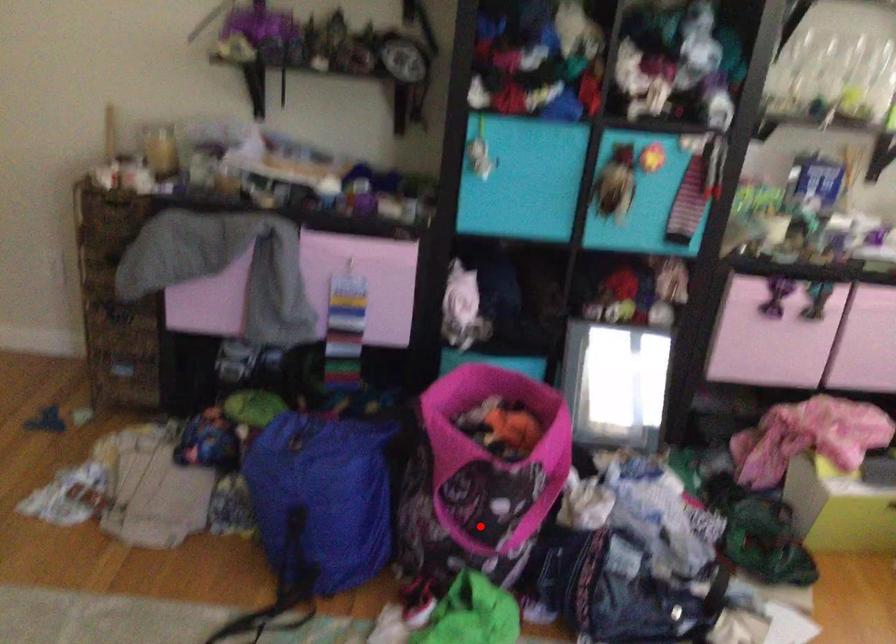
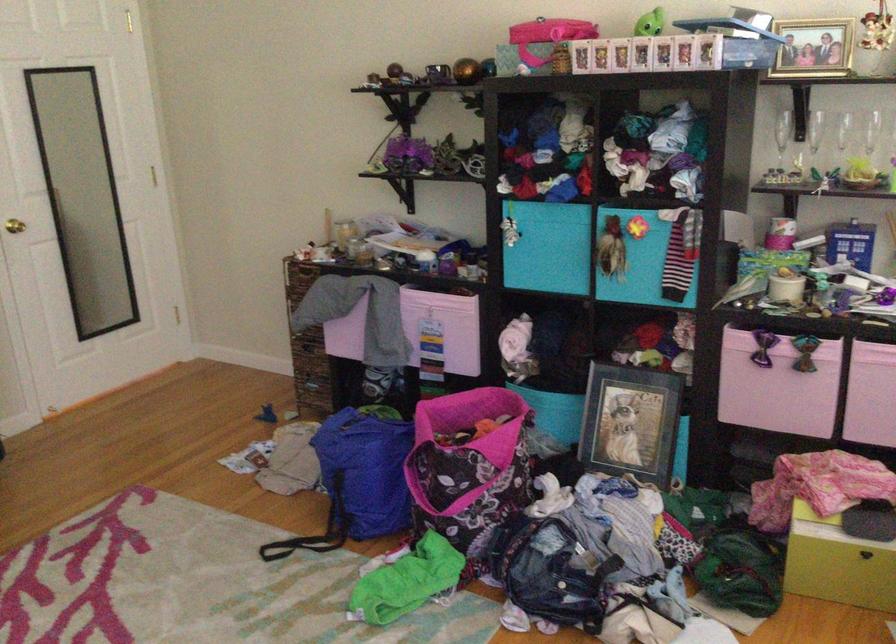
Question: I am providing you with two images of the same scene from different viewpoints. Image1 has a red point marked. In image2, the corresponding 3D location appears at what relative position? Reply with the corresponding letter.

Choices:
 (A) Closer
 (B) Farther

Answer: (B)